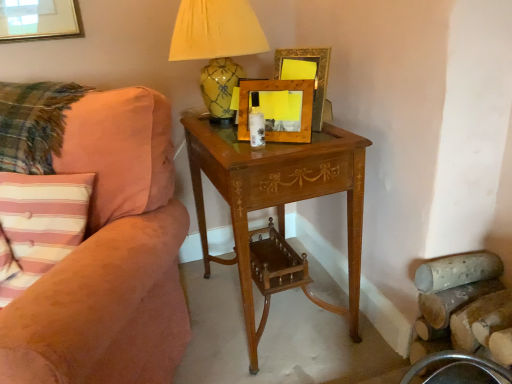
Question: From a real-world perspective, is yellow glazed ceramic lamp at upper center located higher than wooden picture frame at center, arranged as the 1th picture frame when viewed from the front?

Choices:
 (A) yes
 (B) no

Answer: (A)

Question: Considering the relative sizes of yellow glazed ceramic lamp at upper center and wooden picture frame at center, arranged as the 1th picture frame when viewed from the front, in the image provided, is yellow glazed ceramic lamp at upper center shorter than wooden picture frame at center, arranged as the 1th picture frame when viewed from the front,?

Choices:
 (A) no
 (B) yes

Answer: (A)

Question: Can you confirm if yellow glazed ceramic lamp at upper center is bigger than wooden picture frame at center, arranged as the 1th picture frame when viewed from the front?

Choices:
 (A) yes
 (B) no

Answer: (A)

Question: Is yellow glazed ceramic lamp at upper center oriented away from wooden picture frame at center, which appears as the second picture frame when viewed from the back?

Choices:
 (A) no
 (B) yes

Answer: (A)

Question: Is yellow glazed ceramic lamp at upper center completely or partially outside of wooden picture frame at center, arranged as the 1th picture frame when viewed from the front?

Choices:
 (A) no
 (B) yes

Answer: (B)

Question: Is wooden picture frame at upper center, placed as the 2th picture frame when sorted from front to back, bigger or smaller than light brown wood nightstand at center?

Choices:
 (A) big
 (B) small

Answer: (B)

Question: From the image's perspective, relative to light brown wood nightstand at center, is wooden picture frame at upper center, the 1th picture frame in the back-to-front sequence, above or below?

Choices:
 (A) below
 (B) above

Answer: (B)

Question: Is wooden picture frame at upper center, the 1th picture frame in the back-to-front sequence, situated inside light brown wood nightstand at center or outside?

Choices:
 (A) outside
 (B) inside

Answer: (A)

Question: From a real-world perspective, is wooden picture frame at upper center, placed as the 2th picture frame when sorted from front to back, physically located above or below light brown wood nightstand at center?

Choices:
 (A) below
 (B) above

Answer: (B)

Question: From a real-world perspective, relative to suede-like peach couch at left, is wooden picture frame at upper center, the 1th picture frame in the back-to-front sequence, vertically above or below?

Choices:
 (A) above
 (B) below

Answer: (A)

Question: Which is correct: wooden picture frame at upper center, the 1th picture frame in the back-to-front sequence, is inside suede-like peach couch at left, or outside of it?

Choices:
 (A) outside
 (B) inside

Answer: (A)

Question: Is point (283, 49) positioned closer to the camera than point (165, 203)?

Choices:
 (A) farther
 (B) closer

Answer: (A)

Question: From the image's perspective, is wooden picture frame at upper center, placed as the 2th picture frame when sorted from front to back, located above or below suede-like peach couch at left?

Choices:
 (A) above
 (B) below

Answer: (A)

Question: Considering the positions of yellow glazed ceramic lamp at upper center and wooden picture frame at upper center, the 1th picture frame in the back-to-front sequence, in the image, is yellow glazed ceramic lamp at upper center bigger or smaller than wooden picture frame at upper center, the 1th picture frame in the back-to-front sequence,?

Choices:
 (A) small
 (B) big

Answer: (B)

Question: Is yellow glazed ceramic lamp at upper center inside the boundaries of wooden picture frame at upper center, the 1th picture frame in the back-to-front sequence, or outside?

Choices:
 (A) outside
 (B) inside

Answer: (A)